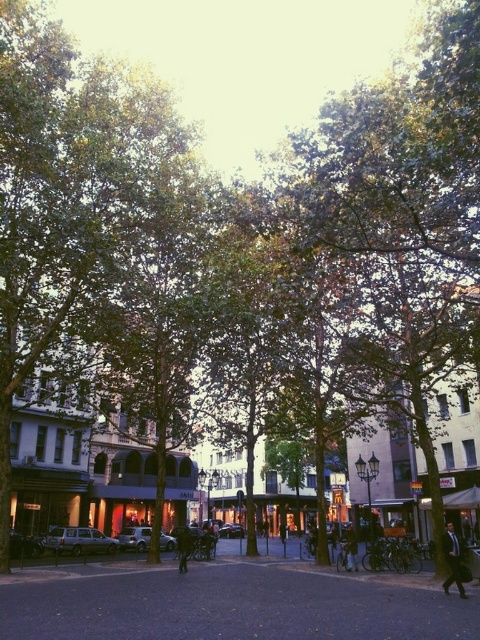
Does dark suit at center come in front of dark brown leather jacket at center?

Yes, it is.

Between dark suit at center and dark brown leather jacket at center, which one appears on the right side from the viewer's perspective?

dark suit at center is more to the right.

Is point (452, 540) behind point (184, 557)?

No.

Where is `dark suit at center`? The height and width of the screenshot is (640, 480). dark suit at center is located at coordinates (453, 561).

Which is more to the right, dark suit at center or dark blue jeans at center?

From the viewer's perspective, dark suit at center appears more on the right side.

Does point (444, 588) come behind point (356, 554)?

No.

What do you see at coordinates (453, 561) in the screenshot? The image size is (480, 640). I see `dark suit at center` at bounding box center [453, 561].

Image resolution: width=480 pixels, height=640 pixels. Identify the location of dark suit at center. (453, 561).

Can you confirm if dark blue jeans at center is positioned below dark brown leather jacket at center?

Yes.

Is dark blue jeans at center wider than dark brown leather jacket at center?

Yes, dark blue jeans at center is wider than dark brown leather jacket at center.

Between point (349, 529) and point (186, 532), which one is positioned behind?

The point (349, 529) is behind.

At what (x,y) coordinates should I click in order to perform the action: click on dark blue jeans at center. Please return your answer as a coordinate pair (x, y). The height and width of the screenshot is (640, 480). Looking at the image, I should click on [349, 547].